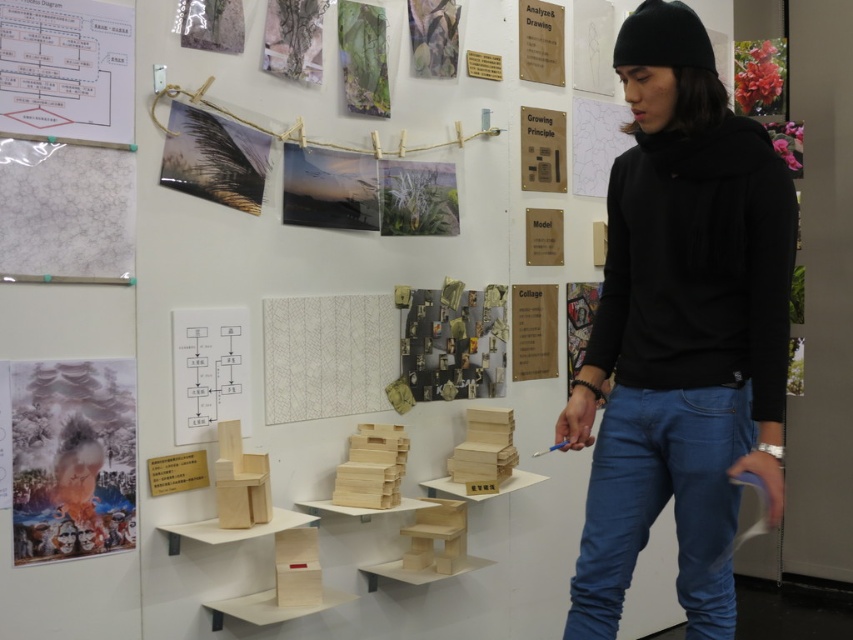
You are an artist in the studio and need to choose a garment to wear over your artwork. Which item, the black cotton hoodie at upper right or the black fleece sweatshirt at right, has a larger size and would be more suitable for covering a large canvas?

The black cotton hoodie at upper right is bigger than the black fleece sweatshirt at right, so it would be more suitable for covering a large canvas.

You are an interior designer assessing the space in the studio. You need to place a new rectangular shelf that is 1 meter wide. The shelf must be placed either where the blue denim jeans at lower right is or where the matte paper poster at left is. Which location has enough space to accommodate the shelf without exceeding its width?

The blue denim jeans at lower right has a width that surpasses the matte paper poster at left, so placing the shelf at the location of the blue denim jeans at lower right would be more suitable as it can accommodate the 1 meter wide shelf.

You are an artist in the studio and need to place a new poster on the wall. The poster must be positioned to the left of the blue denim jeans at lower right. Where should you place the new poster?

The new poster should be placed to the left of the blue denim jeans at lower right, which is at point 0.787 on the x and 0.777 on the y coordinate. Therefore, the poster should be placed at a position with an x coordinate less than 0.787 but maintaining the same y coordinate to ensure it is directly to the left.